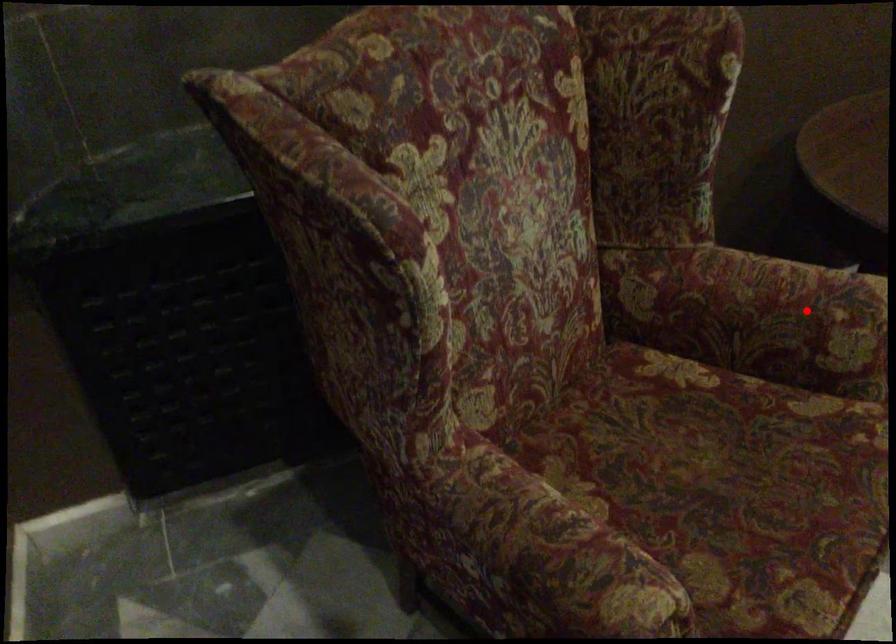
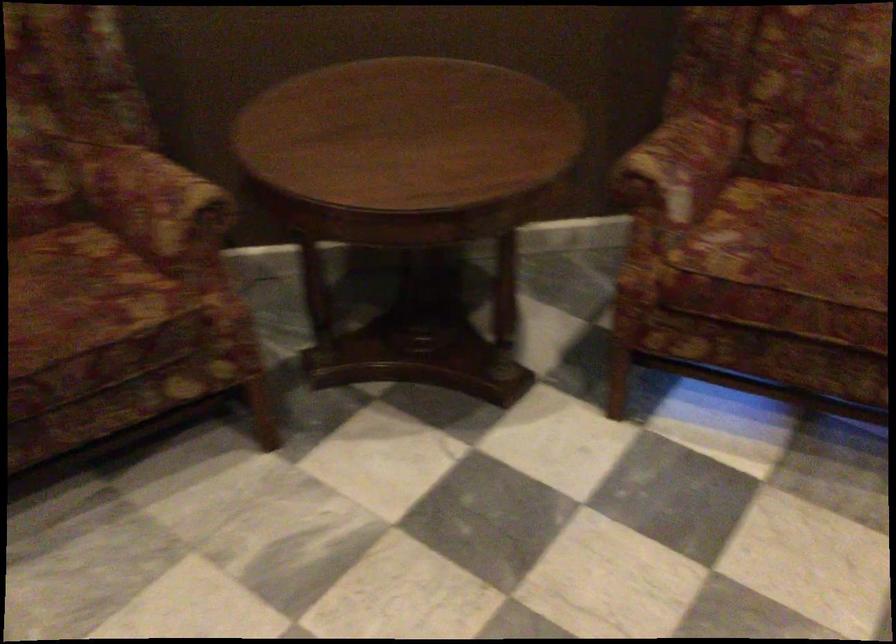
Locate, in the second image, the point that corresponds to the highlighted location in the first image.

(156, 204)